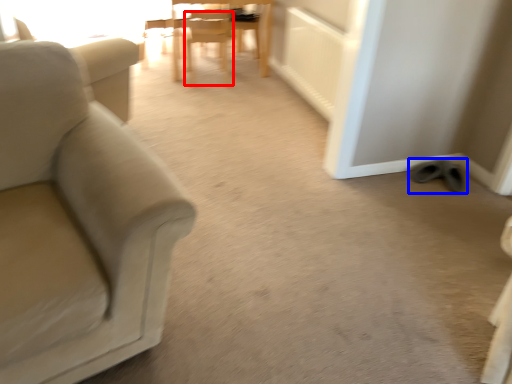
Question: Which object is closer to the camera taking this photo, chair (highlighted by a red box) or footwear (highlighted by a blue box)?

Choices:
 (A) chair
 (B) footwear

Answer: (B)